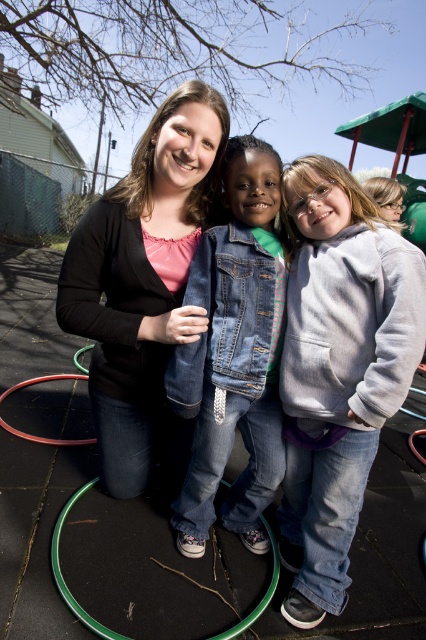
Question: Which point is farther from the camera taking this photo?

Choices:
 (A) (123, 266)
 (B) (253, 417)
 (C) (305, 397)

Answer: (B)

Question: Can you confirm if gray fleece hoodie at center is positioned below black matte cardigan at center?

Choices:
 (A) yes
 (B) no

Answer: (A)

Question: Which point is farther from the camera taking this photo?

Choices:
 (A) (357, 314)
 (B) (192, 122)

Answer: (B)

Question: In this image, where is black matte cardigan at center located relative to green rubber hula hoop at lower center?

Choices:
 (A) above
 (B) below

Answer: (A)

Question: Can you confirm if gray fleece hoodie at center is positioned below denim jacket at center?

Choices:
 (A) no
 (B) yes

Answer: (B)

Question: Which point is farther to the camera?

Choices:
 (A) (23, 381)
 (B) (121, 636)
 (C) (224, 310)

Answer: (A)